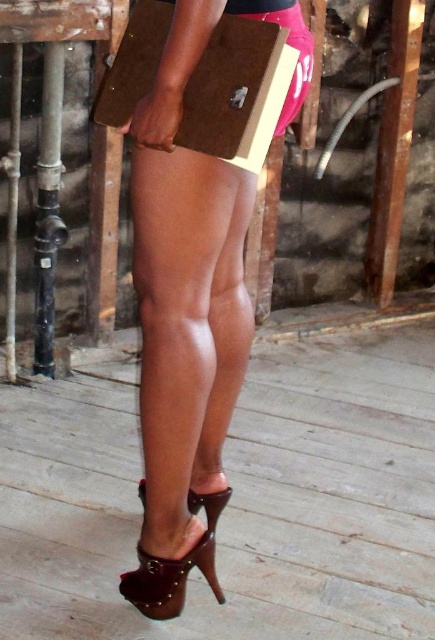
Does point (170, 378) come farther from viewer compared to point (233, 106)?

Yes, it is behind point (233, 106).

Who is taller, satin brown clutch at center or matte brown cardboard box at center?

satin brown clutch at center is taller.

Measure the distance between point (171, 182) and camera.

Point (171, 182) and camera are 5.50 feet apart.

In order to click on satin brown clutch at center in this screenshot , I will do `click(190, 305)`.

Can you confirm if matte brown cardboard box at center is positioned above brown leather sandal at lower center?

Indeed, matte brown cardboard box at center is positioned over brown leather sandal at lower center.

The height and width of the screenshot is (640, 435). Describe the element at coordinates (237, 92) in the screenshot. I see `matte brown cardboard box at center` at that location.

Who is more forward, (187, 129) or (140, 592)?

Point (187, 129)

Locate an element on the screen. This screenshot has width=435, height=640. matte brown cardboard box at center is located at coordinates (237, 92).

Is satin brown clutch at center to the right of brown leather sandal at lower center from the viewer's perspective?

Yes, satin brown clutch at center is to the right of brown leather sandal at lower center.

Which is behind, point (186, 552) or point (198, 548)?

Positioned behind is point (198, 548).

The height and width of the screenshot is (640, 435). I want to click on satin brown clutch at center, so click(190, 305).

Identify the location of satin brown clutch at center. (190, 305).